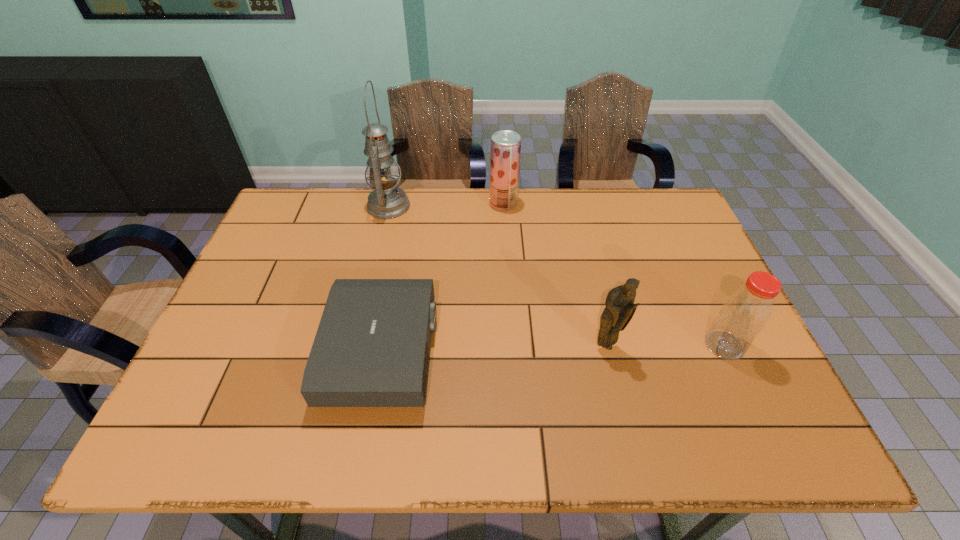
Identify which object is the fourth closest to the projector. Please provide its 2D coordinates. Your answer should be formatted as a tuple, i.e. [(x, y)], where the tuple contains the x and y coordinates of a point satisfying the conditions above.

[(745, 313)]

The height and width of the screenshot is (540, 960). In order to click on vacant space that satisfies the following two spatial constraints: 1. on the front side of the rightmost object; 2. on the front-facing side of the projector in this screenshot , I will do `click(728, 352)`.

Find the location of a particular element. The width and height of the screenshot is (960, 540). free location that satisfies the following two spatial constraints: 1. on the front side of the rightmost object; 2. on the front-facing side of the projector is located at coordinates (728, 352).